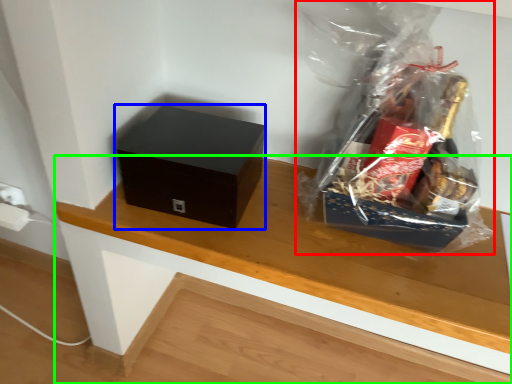
Question: Based on their relative distances, which object is farther from plastic bag (highlighted by a red box)? Choose from box (highlighted by a blue box) and table (highlighted by a green box).

Choices:
 (A) box
 (B) table

Answer: (A)